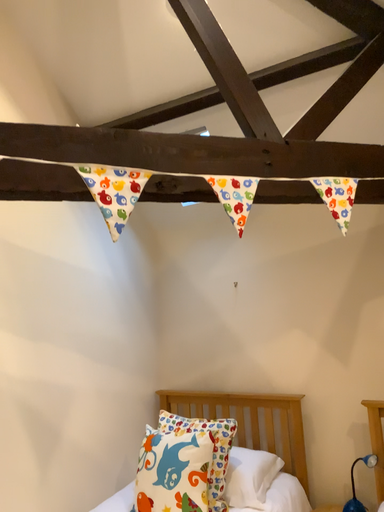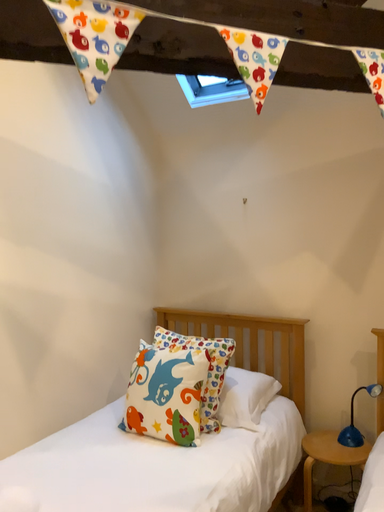
Question: Which way did the camera rotate in the video?

Choices:
 (A) rotated upward
 (B) rotated downward

Answer: (B)